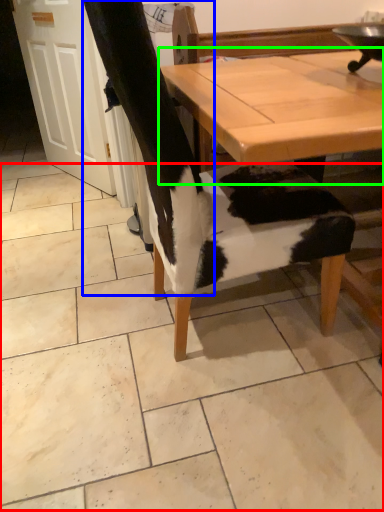
Question: Estimate the real-world distances between objects in this image. Which object is closer to tile (highlighted by a red box), leg (highlighted by a blue box) or table (highlighted by a green box)?

Choices:
 (A) leg
 (B) table

Answer: (A)